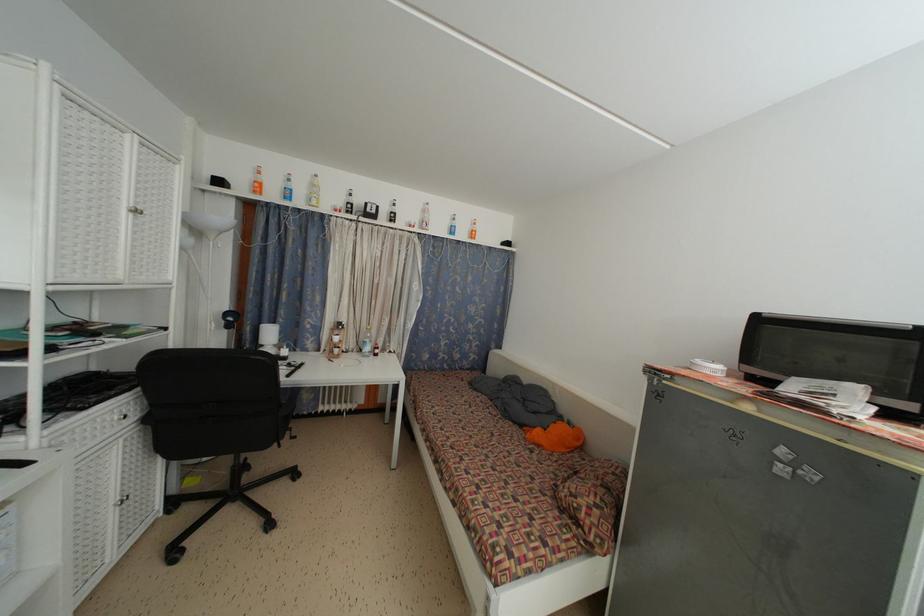
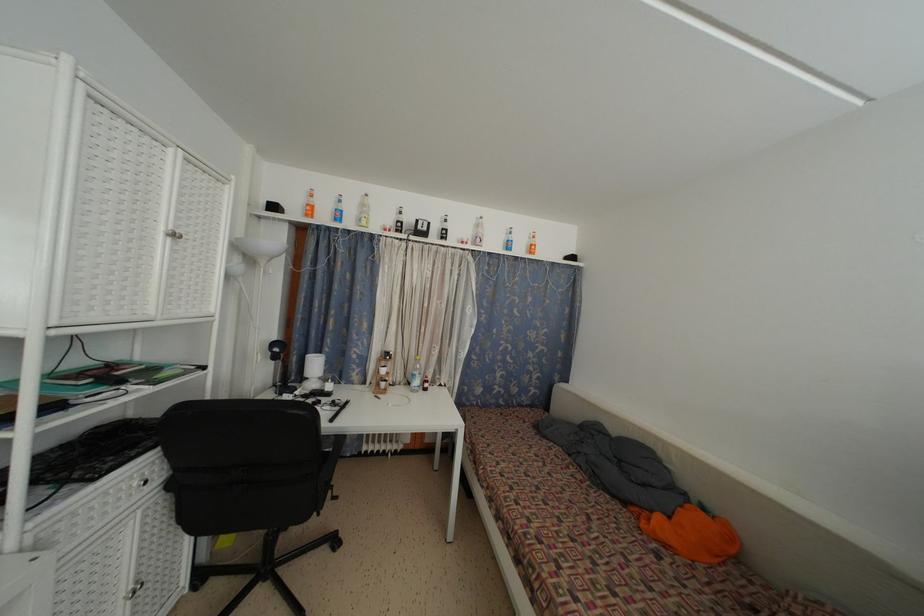
In the second image, find the point that corresponds to point (429, 217) in the first image.

(481, 232)